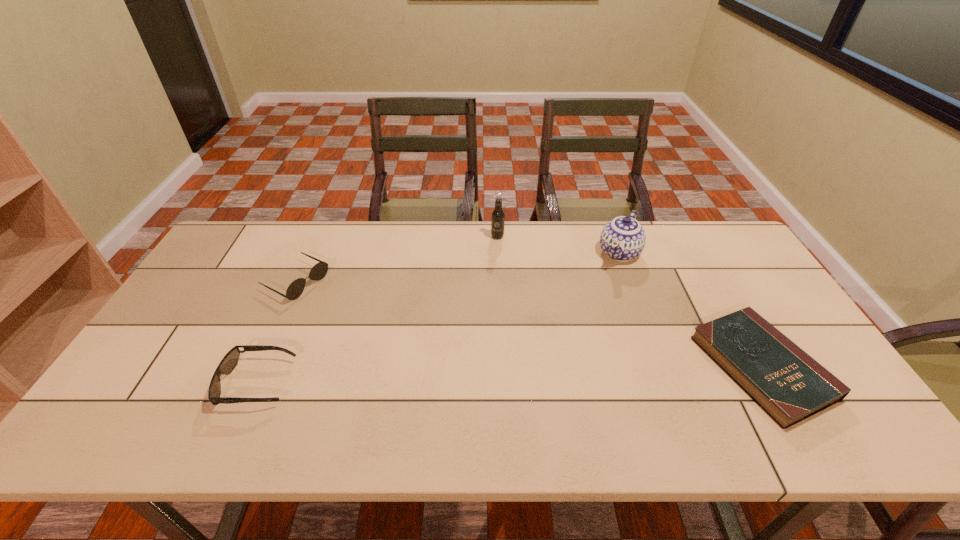
Image resolution: width=960 pixels, height=540 pixels. I want to click on chinaware positioned at the far edge, so click(x=623, y=238).

Where is `root beer present at the far edge`? This screenshot has height=540, width=960. root beer present at the far edge is located at coordinates (498, 216).

Identify the location of sunglasses present at the far edge. (319, 270).

Locate an element on the screen. sunglasses at the near edge is located at coordinates point(230,360).

Locate an element on the screen. Bible at the near edge is located at coordinates (789, 385).

This screenshot has width=960, height=540. In order to click on object present at the right edge in this screenshot , I will do `click(789, 385)`.

The image size is (960, 540). What are the coordinates of `object located at the near right corner` in the screenshot? It's located at (789, 385).

Identify the location of vacant space at the far edge. (276, 239).

Where is `vacant region at the near edge`? This screenshot has height=540, width=960. vacant region at the near edge is located at coordinates (324, 387).

You are a GUI agent. You are given a task and a screenshot of the screen. Output one action in this format:
    pyautogui.click(x=<x>, y=<y>)
    Task: Click on the free point at the left edge
    This screenshot has height=540, width=960.
    Given the screenshot: What is the action you would take?
    pyautogui.click(x=241, y=282)